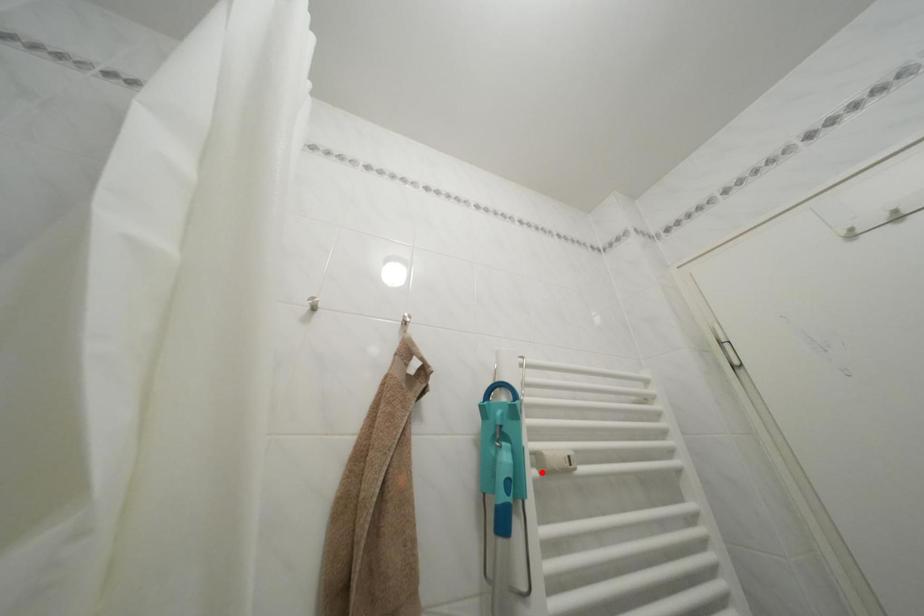
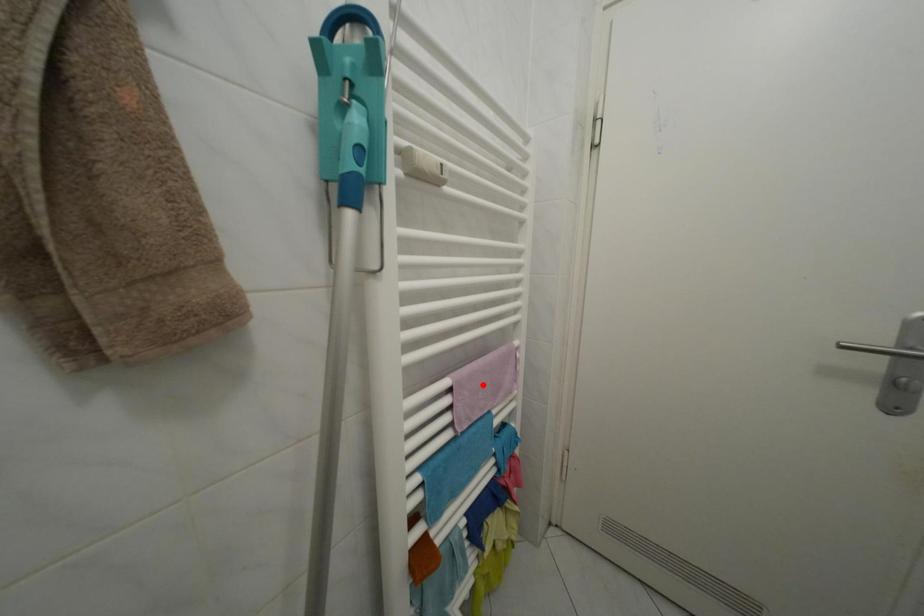
I am providing you with two images of the same scene from different viewpoints. A red point is marked on the first image and another point is marked on the second image. Is the red point in image1 aligned with the point shown in image2?

No